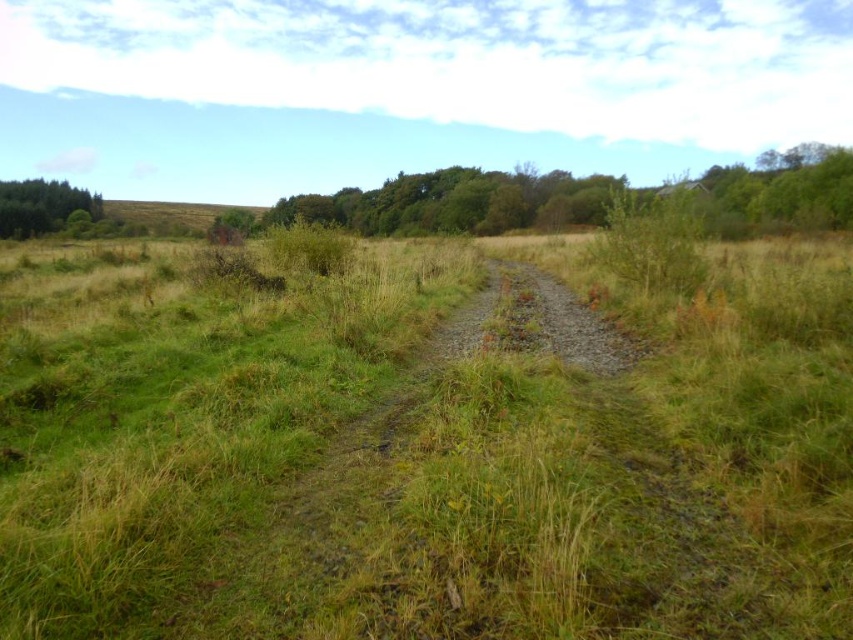
Who is taller, green grassy at center or green leafy trees at left?

Standing taller between the two is green leafy trees at left.

Which is behind, point (180, 269) or point (38, 198)?

Point (38, 198)

Is point (838, 516) closer to camera compared to point (56, 211)?

Yes, it is.

The width and height of the screenshot is (853, 640). Find the location of `green grassy at center`. green grassy at center is located at coordinates (421, 452).